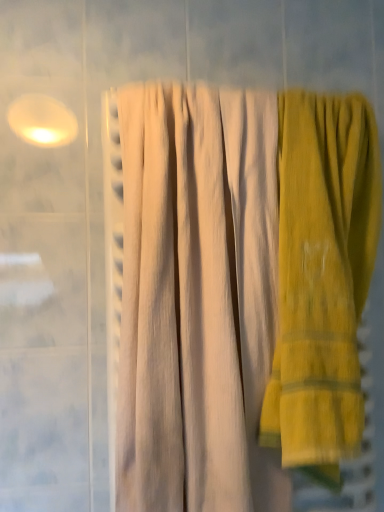
The image size is (384, 512). Describe the element at coordinates (322, 278) in the screenshot. I see `yellow corduroy towel at right` at that location.

What is the approximate height of yellow corduroy towel at right?

yellow corduroy towel at right is 28.86 inches in height.

You are a GUI agent. You are given a task and a screenshot of the screen. Output one action in this format:
    pyautogui.click(x=<x>, y=<y>)
    Task: Click on the yellow corduroy towel at right
    Image resolution: width=384 pixels, height=512 pixels.
    Given the screenshot: What is the action you would take?
    pyautogui.click(x=322, y=278)

This screenshot has width=384, height=512. What do you see at coordinates (197, 298) in the screenshot?
I see `beige textured towel at center` at bounding box center [197, 298].

In order to click on beige textured towel at center in this screenshot , I will do `click(197, 298)`.

The image size is (384, 512). In order to click on yellow corduroy towel at right in this screenshot , I will do `click(322, 278)`.

Can you confirm if yellow corduroy towel at right is positioned to the right of beige textured towel at center?

Yes.

Which object is further away from the camera taking this photo, yellow corduroy towel at right or beige textured towel at center?

yellow corduroy towel at right is more distant.

Does point (299, 225) come behind point (164, 400)?

Yes, it is.

From the image's perspective, between yellow corduroy towel at right and beige textured towel at center, who is located below?

yellow corduroy towel at right, from the image's perspective.

From a real-world perspective, is yellow corduroy towel at right physically located above or below beige textured towel at center?

yellow corduroy towel at right is below beige textured towel at center.

Considering the sizes of objects yellow corduroy towel at right and beige textured towel at center in the image provided, who is wider, yellow corduroy towel at right or beige textured towel at center?

With larger width is beige textured towel at center.

Does yellow corduroy towel at right have a lesser height compared to beige textured towel at center?

Indeed, yellow corduroy towel at right has a lesser height compared to beige textured towel at center.

Which of these two, yellow corduroy towel at right or beige textured towel at center, is smaller?

With smaller size is yellow corduroy towel at right.

Choose the correct answer: Is yellow corduroy towel at right inside beige textured towel at center or outside it?

yellow corduroy towel at right lies outside beige textured towel at center.

Is yellow corduroy towel at right far from beige textured towel at center?

No, yellow corduroy towel at right is in close proximity to beige textured towel at center.

Is yellow corduroy towel at right facing towards beige textured towel at center?

No, yellow corduroy towel at right is not turned towards beige textured towel at center.

From the picture: Can you tell me how much yellow corduroy towel at right and beige textured towel at center differ in facing direction?

The angle between the facing direction of yellow corduroy towel at right and the facing direction of beige textured towel at center is 7.27e-05 degrees.

Consider the image. Measure the distance between yellow corduroy towel at right and beige textured towel at center.

They are 4.45 inches apart.

You are a GUI agent. You are given a task and a screenshot of the screen. Output one action in this format:
    pyautogui.click(x=<x>, y=<y>)
    Task: Click on the towel behind the beige textured towel at center
    This screenshot has height=512, width=384.
    Given the screenshot: What is the action you would take?
    pyautogui.click(x=322, y=278)

Does beige textured towel at center appear on the right side of yellow corduroy towel at right?

No, beige textured towel at center is not to the right of yellow corduroy towel at right.

In the image, is beige textured towel at center positioned in front of or behind yellow corduroy towel at right?

Clearly, beige textured towel at center is in front of yellow corduroy towel at right.

Does point (175, 315) appear closer or farther from the camera than point (311, 288)?

Point (175, 315) is farther from the camera than point (311, 288).

From the image's perspective, who appears lower, beige textured towel at center or yellow corduroy towel at right?

yellow corduroy towel at right, from the image's perspective.

From a real-world perspective, is beige textured towel at center positioned under yellow corduroy towel at right based on gravity?

No, from a real-world perspective, beige textured towel at center is not below yellow corduroy towel at right.

In terms of width, does beige textured towel at center look wider or thinner when compared to yellow corduroy towel at right?

Clearly, beige textured towel at center has more width compared to yellow corduroy towel at right.

Which of these two, beige textured towel at center or yellow corduroy towel at right, stands taller?

Standing taller between the two is beige textured towel at center.

Who is bigger, beige textured towel at center or yellow corduroy towel at right?

With larger size is beige textured towel at center.

From the picture: Is yellow corduroy towel at right located within beige textured towel at center?

No, yellow corduroy towel at right is not surrounded by beige textured towel at center.

Can you see beige textured towel at center touching yellow corduroy towel at right?

No, beige textured towel at center is not touching yellow corduroy towel at right.

Does beige textured towel at center turn towards yellow corduroy towel at right?

No, beige textured towel at center is not oriented towards yellow corduroy towel at right.

How different are the orientations of beige textured towel at center and yellow corduroy towel at right in degrees?

beige textured towel at center and yellow corduroy towel at right are facing 7.27e-05 degrees away from each other.

How far apart are beige textured towel at center and yellow corduroy towel at right?

beige textured towel at center and yellow corduroy towel at right are 4.45 inches apart from each other.

You are a GUI agent. You are given a task and a screenshot of the screen. Output one action in this format:
    pyautogui.click(x=<x>, y=<y>)
    Task: Click on the towel lying below the beige textured towel at center (from the image's perspective)
    Image resolution: width=384 pixels, height=512 pixels.
    Given the screenshot: What is the action you would take?
    pyautogui.click(x=322, y=278)

You are a GUI agent. You are given a task and a screenshot of the screen. Output one action in this format:
    pyautogui.click(x=<x>, y=<y>)
    Task: Click on the curtain that is on the left side of yellow corduroy towel at right
    
    Given the screenshot: What is the action you would take?
    pyautogui.click(x=197, y=298)

Identify the location of towel behind the beige textured towel at center. Image resolution: width=384 pixels, height=512 pixels. (322, 278).